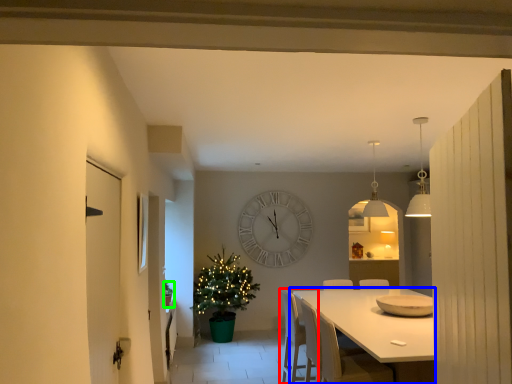
Question: Estimate the real-world distances between objects in this image. Which object is farther from chair (highlighted by a red box), kitchen & dining room table (highlighted by a blue box) or houseplant (highlighted by a green box)?

Choices:
 (A) kitchen & dining room table
 (B) houseplant

Answer: (B)